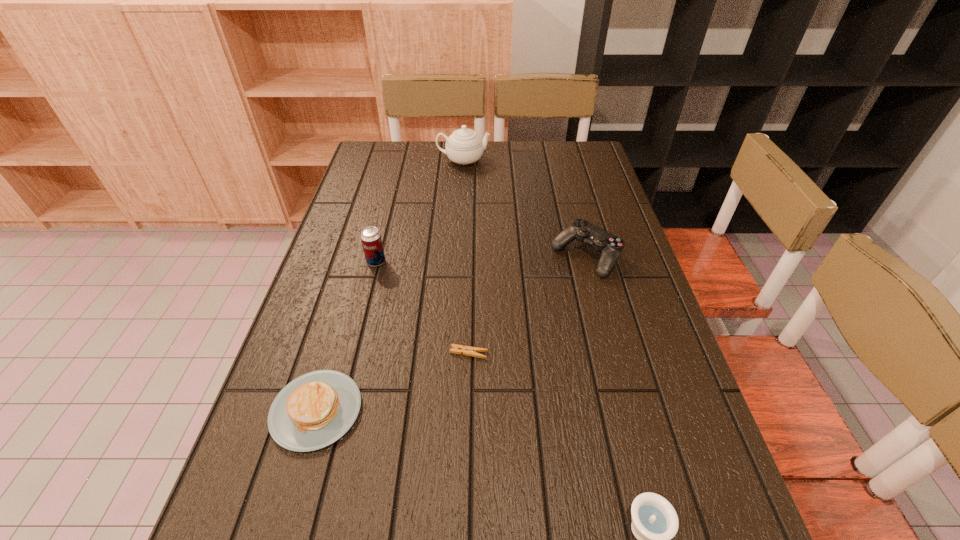
Find the location of a particular element. free location located on the back of the control is located at coordinates (565, 175).

You are a GUI agent. You are given a task and a screenshot of the screen. Output one action in this format:
    pyautogui.click(x=<x>, y=<y>)
    Task: Click on the vacant space located 0.200m on the right of the second shortest object
    This screenshot has height=540, width=960.
    Given the screenshot: What is the action you would take?
    pyautogui.click(x=462, y=410)

In order to click on free space located on the right of the clothespin in this screenshot , I will do `click(588, 353)`.

In order to click on object that is at the far edge in this screenshot , I will do `click(464, 146)`.

You are a GUI agent. You are given a task and a screenshot of the screen. Output one action in this format:
    pyautogui.click(x=<x>, y=<y>)
    Task: Click on the beer can present at the left edge
    Image resolution: width=960 pixels, height=540 pixels.
    Given the screenshot: What is the action you would take?
    pyautogui.click(x=371, y=240)

At what (x,y) coordinates should I click in order to perform the action: click on pancake that is at the left edge. Please return your answer as a coordinate pair (x, y). Image resolution: width=960 pixels, height=540 pixels. Looking at the image, I should click on (313, 411).

This screenshot has width=960, height=540. Identify the location of object that is positioned at the right edge. (610, 246).

Locate an element on the screen. vacant space at the far edge of the desktop is located at coordinates (523, 146).

Where is `vacant space at the left edge of the desktop`? The width and height of the screenshot is (960, 540). vacant space at the left edge of the desktop is located at coordinates (225, 509).

This screenshot has height=540, width=960. What are the coordinates of `vacant area at the right edge` in the screenshot? It's located at (615, 392).